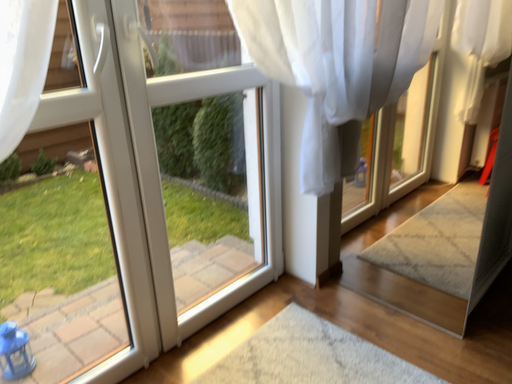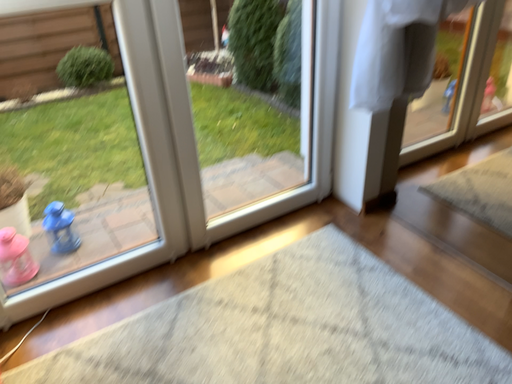
Question: How did the camera likely rotate when shooting the video?

Choices:
 (A) rotated left
 (B) rotated right

Answer: (A)